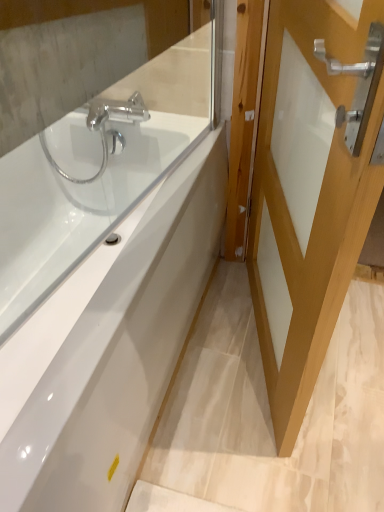
Question: From the image's perspective, is clear glass mirror at upper left, arranged as the first mirror when viewed from the front, beneath clear glass mirror at upper left, acting as the first mirror starting from the back?

Choices:
 (A) yes
 (B) no

Answer: (A)

Question: From the image's perspective, is clear glass mirror at upper left, arranged as the first mirror when viewed from the front, located above clear glass mirror at upper left, the 2th mirror positioned from the front?

Choices:
 (A) yes
 (B) no

Answer: (B)

Question: From a real-world perspective, is clear glass mirror at upper left, arranged as the first mirror when viewed from the front, beneath clear glass mirror at upper left, the 2th mirror positioned from the front?

Choices:
 (A) yes
 (B) no

Answer: (B)

Question: Is clear glass mirror at upper left, which is the 2th mirror in back-to-front order, oriented away from clear glass mirror at upper left, acting as the first mirror starting from the back?

Choices:
 (A) yes
 (B) no

Answer: (A)

Question: Does clear glass mirror at upper left, which is the 2th mirror in back-to-front order, have a larger size compared to clear glass mirror at upper left, the 2th mirror positioned from the front?

Choices:
 (A) no
 (B) yes

Answer: (A)

Question: Is clear glass mirror at upper left, which is the 2th mirror in back-to-front order, far from clear glass mirror at upper left, the 2th mirror positioned from the front?

Choices:
 (A) no
 (B) yes

Answer: (A)

Question: Would you consider clear glass mirror at upper left, acting as the first mirror starting from the back, to be distant from white glossy door at right?

Choices:
 (A) no
 (B) yes

Answer: (A)

Question: From the image's perspective, is clear glass mirror at upper left, the 2th mirror positioned from the front, below white glossy door at right?

Choices:
 (A) no
 (B) yes

Answer: (A)

Question: Is clear glass mirror at upper left, the 2th mirror positioned from the front, at the left side of white glossy door at right?

Choices:
 (A) no
 (B) yes

Answer: (B)

Question: Is clear glass mirror at upper left, acting as the first mirror starting from the back, placed right next to white glossy door at right?

Choices:
 (A) yes
 (B) no

Answer: (B)

Question: Is white glossy door at right located within clear glass mirror at upper left, the 2th mirror positioned from the front?

Choices:
 (A) no
 (B) yes

Answer: (A)

Question: Does clear glass mirror at upper left, the 2th mirror positioned from the front, come behind white glossy door at right?

Choices:
 (A) no
 (B) yes

Answer: (B)

Question: Is white glossy bathtub at center inside clear glass mirror at upper left, which is the 2th mirror in back-to-front order?

Choices:
 (A) yes
 (B) no

Answer: (B)